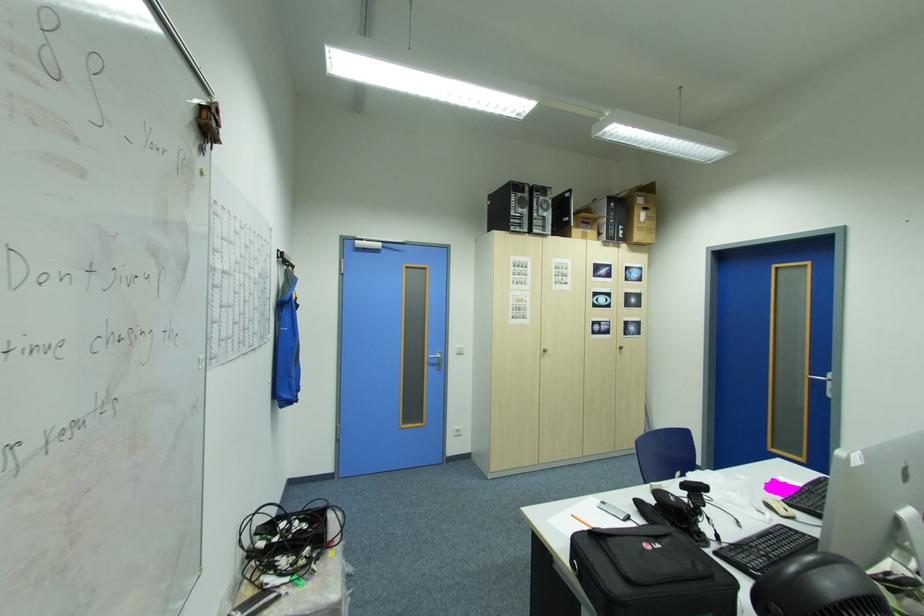
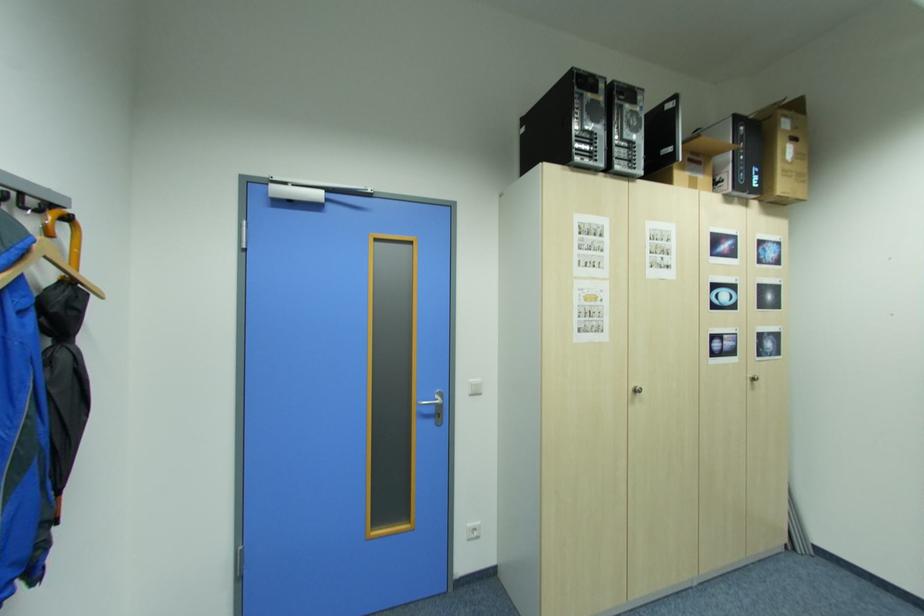
In the second image, find the point that corresponds to point 462,429 in the first image.

(476, 529)